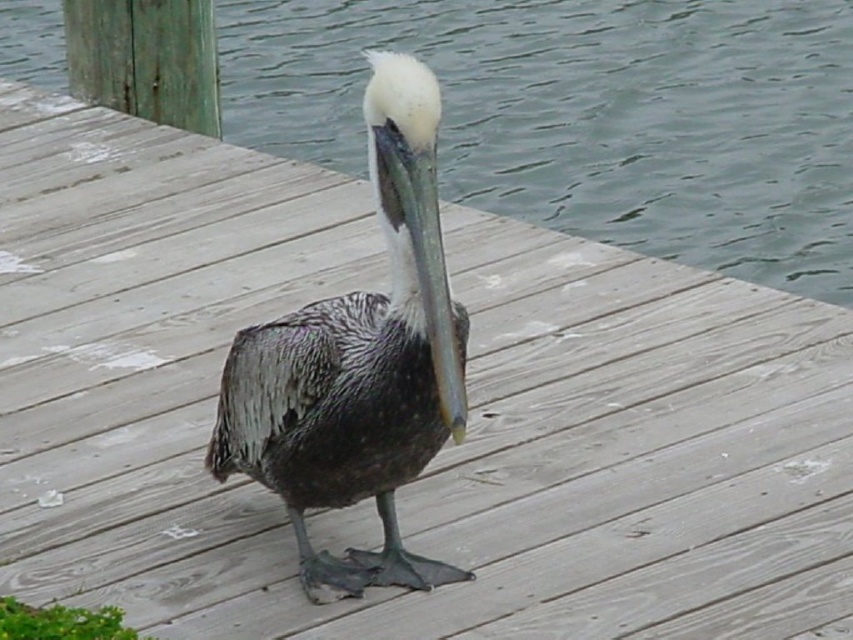
You are a photographer trying to capture the speckled feathered pelican at center and the clear water at center in a single shot. Since the pelican is on the dock, can you position yourself so that the pelican is to the left of the clear water in the frame?

Yes, since the clear water at center is to the right of the speckled feathered pelican at center, positioning yourself appropriately would allow the pelican to be on the left side of the frame with the water to its right, aligning with their actual spatial arrangement.

You are standing on the wooden dock and see the clear water at center and the speckled feathered pelican at center. Which object is located above the other?

The clear water at center is positioned over the speckled feathered pelican at center, meaning the water is above the pelican.

You are a birdwatcher standing on the wooden dock. You want to observe the speckled feathered pelican at center without getting your feet wet. Since the clear water at center is in front of you, can you step over it to reach the dry part of the dock behind?

The clear water at center has a greater height compared to the speckled feathered pelican at center. This means the water is higher than the pelican, so stepping over it might not be possible as the water level is elevated. You should avoid the area with clear water at center to keep your feet dry.